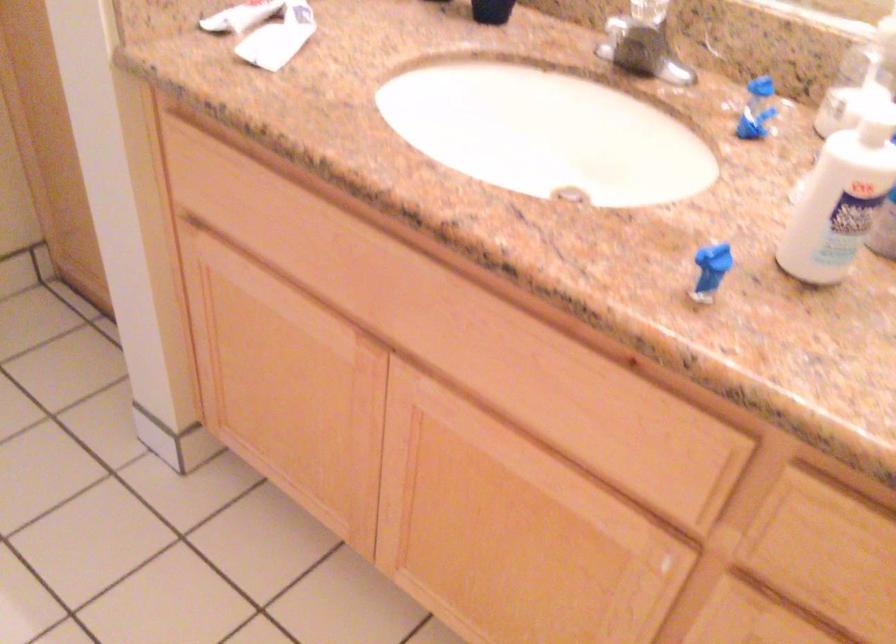
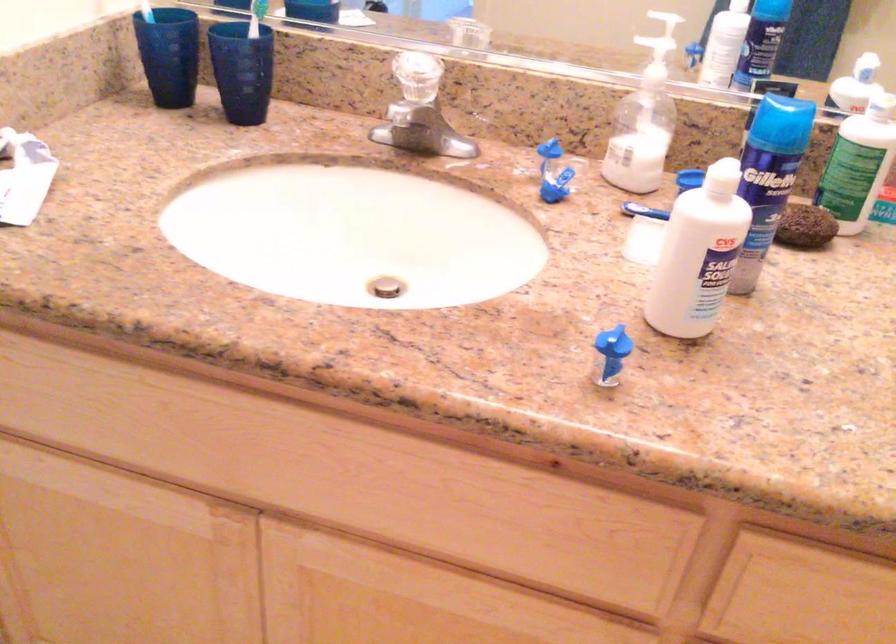
What movement of the cameraman would produce the second image?

The cameraman moved toward left, forward.